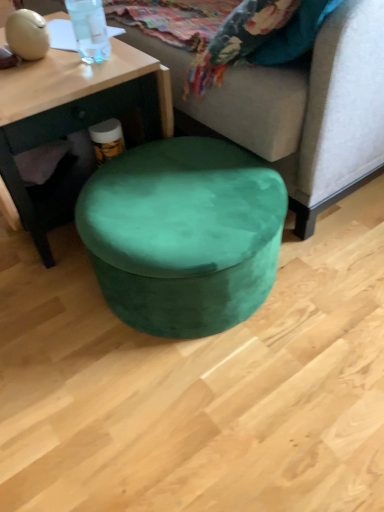
Question: Is matte wood coffee table at center in front of or behind velvet green ottoman at center in the image?

Choices:
 (A) front
 (B) behind

Answer: (B)

Question: From a real-world perspective, is matte wood coffee table at center physically located above or below velvet green ottoman at center?

Choices:
 (A) above
 (B) below

Answer: (A)

Question: Based on their relative distances, which object is farther from the matte wood coffee table at center?

Choices:
 (A) transparent plastic bottle at upper left
 (B) velvet green ottoman at center
 (C) velvet green ottoman at center

Answer: (B)

Question: Estimate the real-world distances between objects in this image. Which object is closer to the matte wood coffee table at center?

Choices:
 (A) transparent plastic bottle at upper left
 (B) velvet green ottoman at center
 (C) velvet green ottoman at center

Answer: (A)